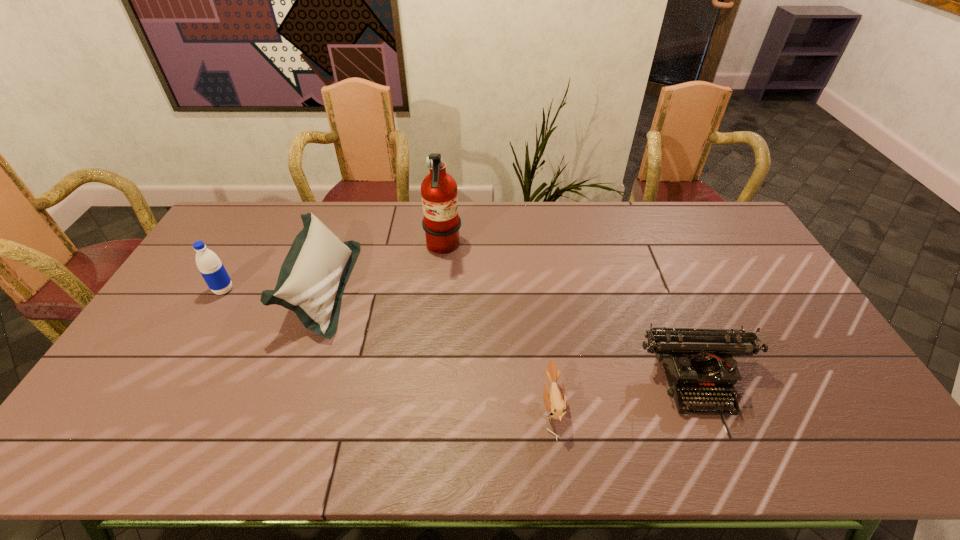
Choose which object is the third nearest neighbor to the cushion. Please provide its 2D coordinates. Your answer should be formatted as a tuple, i.e. [(x, y)], where the tuple contains the x and y coordinates of a point satisfying the conditions above.

[(555, 402)]

Image resolution: width=960 pixels, height=540 pixels. In order to click on vacant area that satisfies the following two spatial constraints: 1. on the keyboard of the typewriter; 2. at the beak of the fourth object from left to right in this screenshot , I will do `click(708, 407)`.

Find the location of `free region that satisfies the following two spatial constraints: 1. on the nozzle and handle of the fire extinguisher; 2. on the front side of the water bottle`. free region that satisfies the following two spatial constraints: 1. on the nozzle and handle of the fire extinguisher; 2. on the front side of the water bottle is located at coordinates (439, 290).